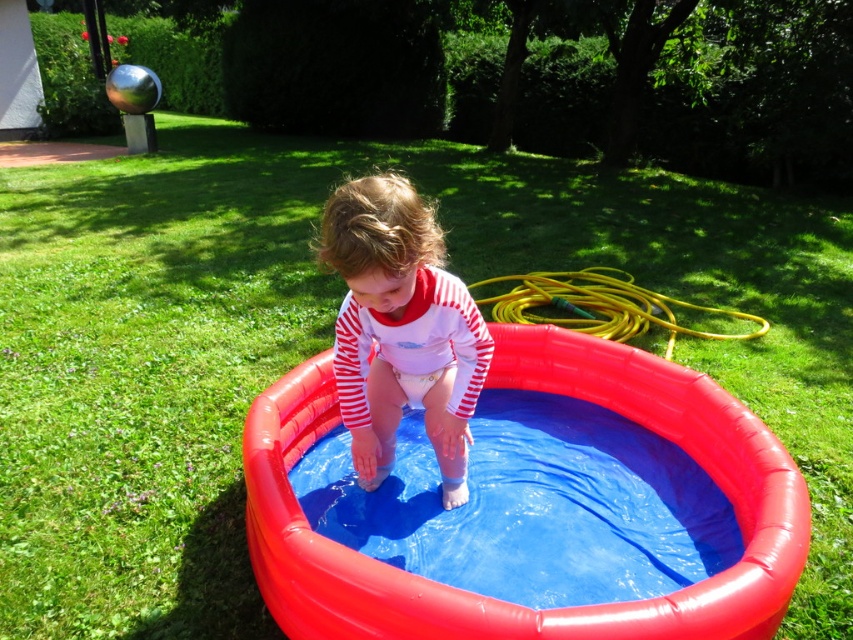
Question: Which of these objects is positioned closest to the white striped shirt at center?

Choices:
 (A) rubber inflatable pool at center
 (B) yellow rubber hose at upper right

Answer: (A)

Question: Is rubber inflatable pool at center bigger than white striped shirt at center?

Choices:
 (A) yes
 (B) no

Answer: (A)

Question: Which point is closer to the camera?

Choices:
 (A) rubber inflatable pool at center
 (B) yellow rubber hose at upper right

Answer: (A)

Question: Is the position of white striped shirt at center less distant than that of yellow rubber hose at upper right?

Choices:
 (A) yes
 (B) no

Answer: (A)

Question: Observing the image, what is the correct spatial positioning of white striped shirt at center in reference to yellow rubber hose at upper right?

Choices:
 (A) left
 (B) right

Answer: (A)

Question: Which point is closer to the camera taking this photo?

Choices:
 (A) (341, 264)
 (B) (735, 625)
 (C) (521, 285)

Answer: (A)